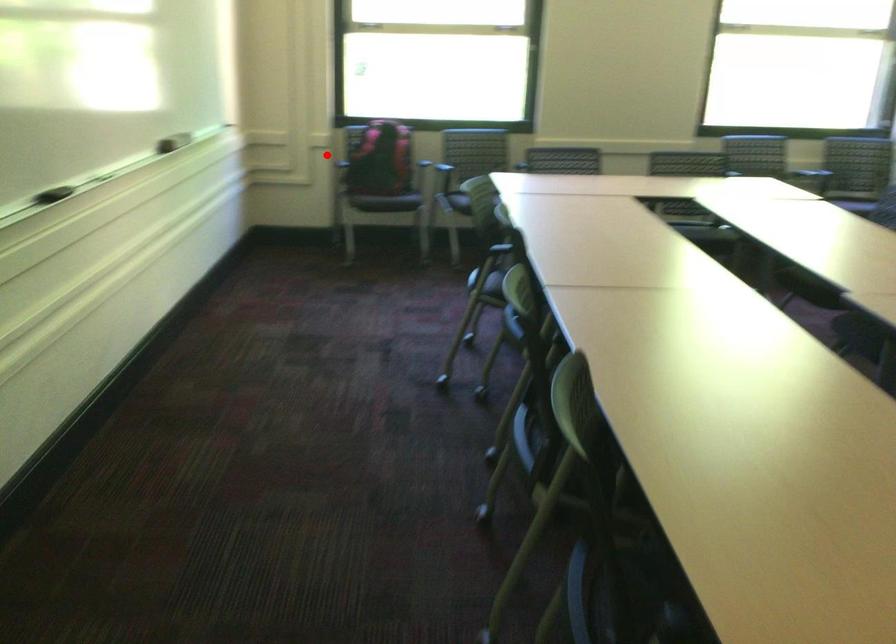
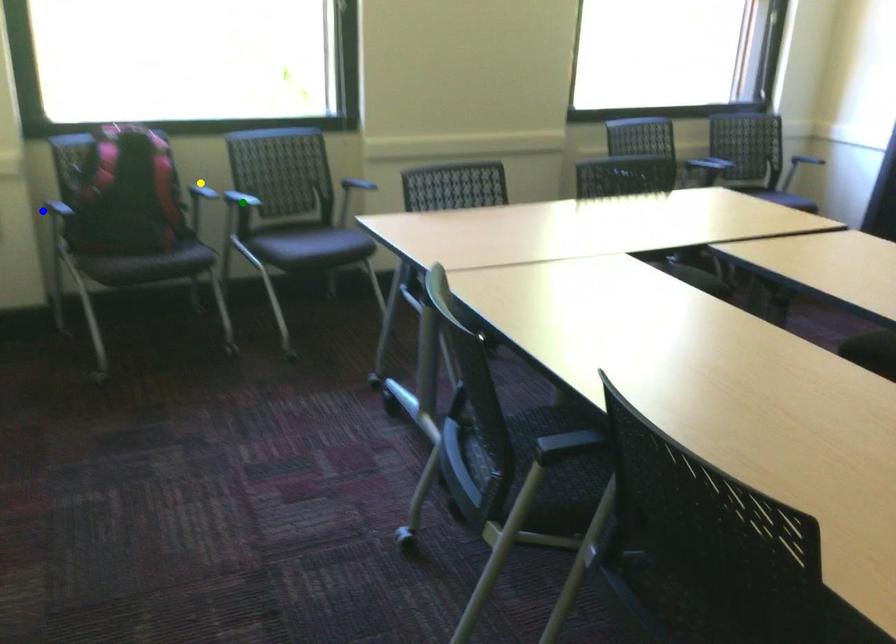
Question: I am providing you with two images of the same scene from different viewpoints. A red point is marked on the first image. You are given multiple points on the second image. Which spot in image 2 lines up with the point in image 1?

Choices:
 (A) yellow point
 (B) blue point
 (C) green point

Answer: (B)